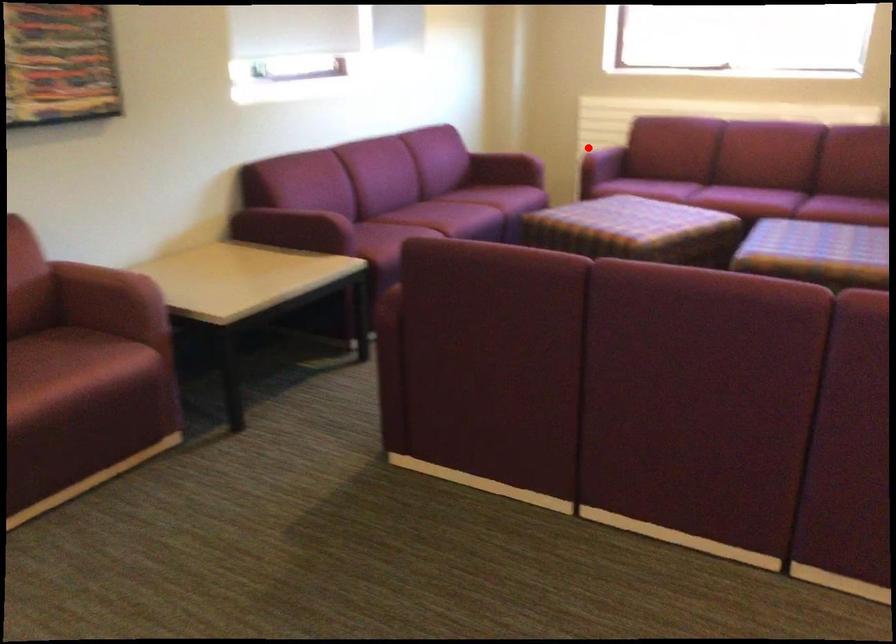
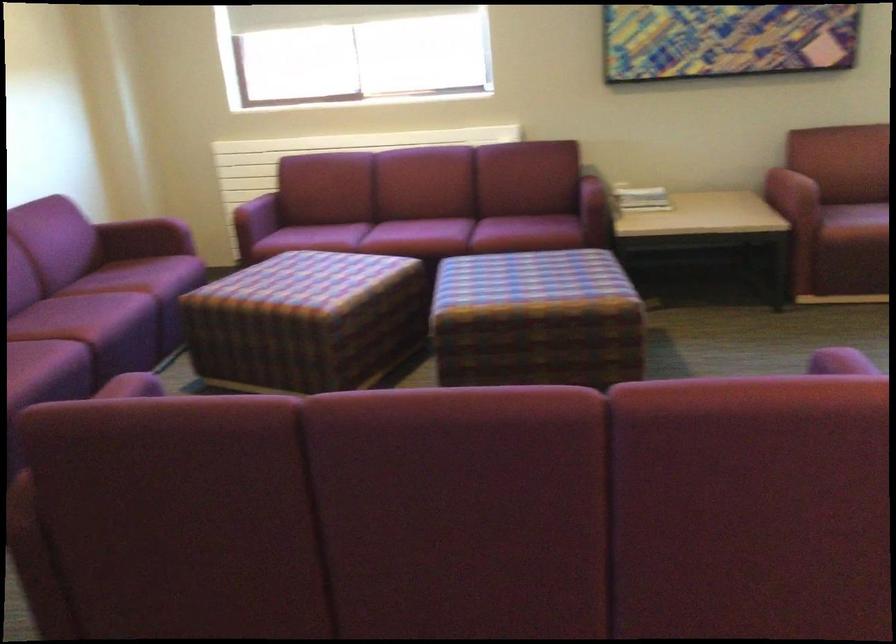
Find the pixel in the second image that matches the highlighted location in the first image.

(242, 198)